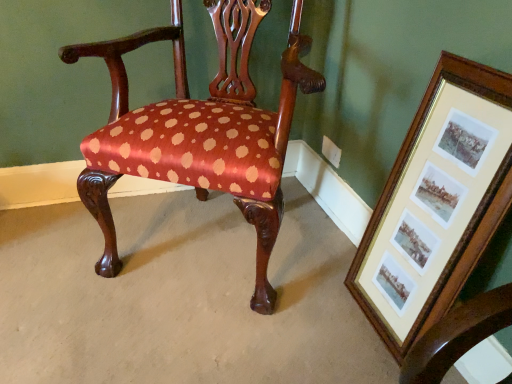
This screenshot has height=384, width=512. What do you see at coordinates (437, 203) in the screenshot?
I see `wooden framed prints at right` at bounding box center [437, 203].

In order to click on wooden framed prints at right in this screenshot , I will do `click(437, 203)`.

What do you see at coordinates (200, 130) in the screenshot?
I see `satin-polka dot chair at center` at bounding box center [200, 130].

This screenshot has width=512, height=384. Find the location of `satin-polka dot chair at center`. satin-polka dot chair at center is located at coordinates (200, 130).

This screenshot has height=384, width=512. I want to click on wooden framed prints at right, so click(437, 203).

Considering the relative positions of satin-polka dot chair at center and wooden framed prints at right in the image provided, is satin-polka dot chair at center to the right of wooden framed prints at right from the viewer's perspective?

No, satin-polka dot chair at center is not to the right of wooden framed prints at right.

Which is behind, satin-polka dot chair at center or wooden framed prints at right?

satin-polka dot chair at center.

Does point (223, 115) come in front of point (365, 298)?

Yes, point (223, 115) is in front of point (365, 298).

From the image's perspective, relative to wooden framed prints at right, is satin-polka dot chair at center above or below?

Clearly, from the image's perspective, satin-polka dot chair at center is above wooden framed prints at right.

From a real-world perspective, which is physically below, satin-polka dot chair at center or wooden framed prints at right?

From a 3D spatial view, wooden framed prints at right is below.

From the picture: In terms of width, does satin-polka dot chair at center look wider or thinner when compared to wooden framed prints at right?

Clearly, satin-polka dot chair at center has more width compared to wooden framed prints at right.

Is satin-polka dot chair at center shorter than wooden framed prints at right?

No, satin-polka dot chair at center is not shorter than wooden framed prints at right.

Considering the relative sizes of satin-polka dot chair at center and wooden framed prints at right in the image provided, is satin-polka dot chair at center smaller than wooden framed prints at right?

No, satin-polka dot chair at center is not smaller than wooden framed prints at right.

Is wooden framed prints at right surrounded by satin-polka dot chair at center?

No, wooden framed prints at right is not a part of satin-polka dot chair at center.

Is satin-polka dot chair at center not close to wooden framed prints at right?

satin-polka dot chair at center is near wooden framed prints at right, not far away.

Does satin-polka dot chair at center turn towards wooden framed prints at right?

No, satin-polka dot chair at center does not turn towards wooden framed prints at right.

How different are the orientations of satin-polka dot chair at center and wooden framed prints at right in degrees?

57.6 degrees separate the facing orientations of satin-polka dot chair at center and wooden framed prints at right.

This screenshot has width=512, height=384. I want to click on chair on the left of wooden framed prints at right, so click(x=200, y=130).

Does wooden framed prints at right appear on the right side of satin-polka dot chair at center?

Correct, you'll find wooden framed prints at right to the right of satin-polka dot chair at center.

Is the position of wooden framed prints at right more distant than that of satin-polka dot chair at center?

No, it is not.

Does point (474, 112) come in front of point (176, 49)?

Yes, it is in front of point (176, 49).

From the image's perspective, between wooden framed prints at right and satin-polka dot chair at center, which one is located above?

satin-polka dot chair at center.

From a real-world perspective, who is located lower, wooden framed prints at right or satin-polka dot chair at center?

In real-world perspective, wooden framed prints at right is lower.

Is wooden framed prints at right thinner than satin-polka dot chair at center?

Indeed, wooden framed prints at right has a lesser width compared to satin-polka dot chair at center.

Who is taller, wooden framed prints at right or satin-polka dot chair at center?

With more height is satin-polka dot chair at center.

Which of these two, wooden framed prints at right or satin-polka dot chair at center, is smaller?

With smaller size is wooden framed prints at right.

Based on the photo, is wooden framed prints at right outside of satin-polka dot chair at center?

wooden framed prints at right lies outside satin-polka dot chair at center's area.

Is wooden framed prints at right placed right next to satin-polka dot chair at center?

They are not placed beside each other.

Is wooden framed prints at right looking in the opposite direction of satin-polka dot chair at center?

No.

How different are the orientations of wooden framed prints at right and satin-polka dot chair at center in degrees?

wooden framed prints at right and satin-polka dot chair at center are facing 57.6 degrees away from each other.

How distant is wooden framed prints at right from satin-polka dot chair at center?

A distance of 18.94 inches exists between wooden framed prints at right and satin-polka dot chair at center.

Identify the location of picture frame in front of the satin-polka dot chair at center. (437, 203).

The image size is (512, 384). In order to click on chair on the left of wooden framed prints at right in this screenshot , I will do `click(200, 130)`.

Where is `picture frame that appears below the satin-polka dot chair at center (from a real-world perspective)`? picture frame that appears below the satin-polka dot chair at center (from a real-world perspective) is located at coordinates (437, 203).